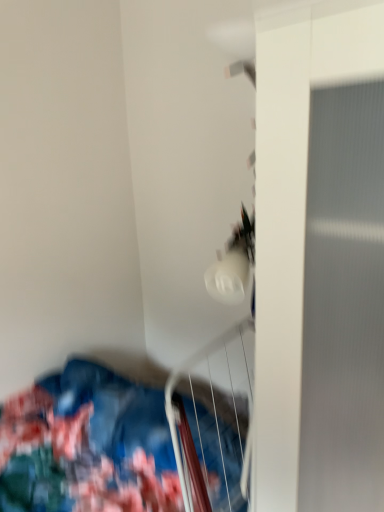
Where is `blue cotton quilt at lower left`? The height and width of the screenshot is (512, 384). blue cotton quilt at lower left is located at coordinates (87, 445).

Consider the image. What is the approximate width of blue cotton quilt at lower left?

blue cotton quilt at lower left is 1.02 meters wide.

Describe the element at coordinates (87, 445) in the screenshot. I see `blue cotton quilt at lower left` at that location.

Find the location of a particular element. blue cotton quilt at lower left is located at coordinates (87, 445).